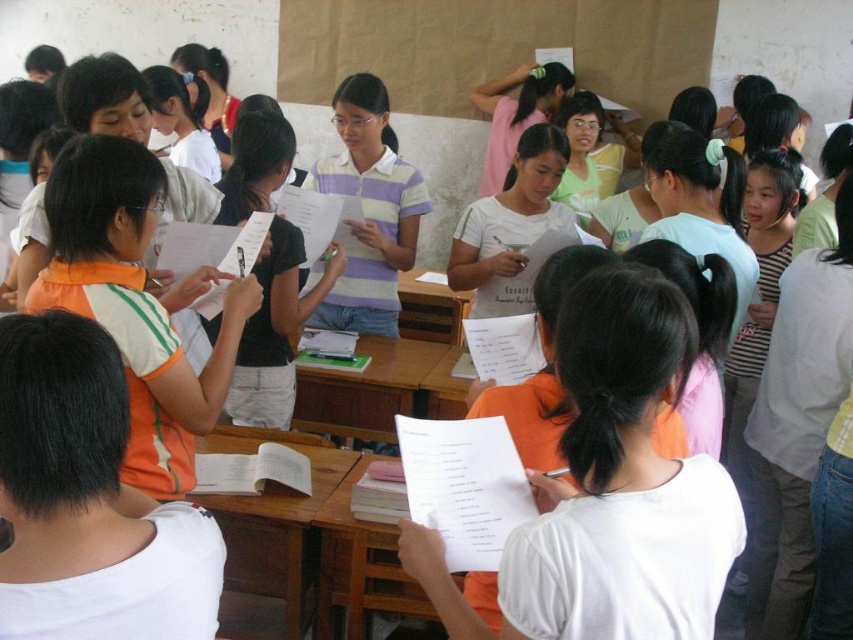
Consider the image. You are a photographer standing at the back of the classroom. You want to take a photo of both the black matte shirt at center and the striped cotton shirt at center so that both are clearly visible in the frame. Considering their distance apart, is it possible to capture both in a single shot without zooming in?

The black matte shirt at center is 18.90 inches from the striped cotton shirt at center. Since 18.90 inches is a relatively short distance, it should be possible to capture both in a single shot without zooming in, provided the camera is positioned appropriately to include both subjects within the frame.